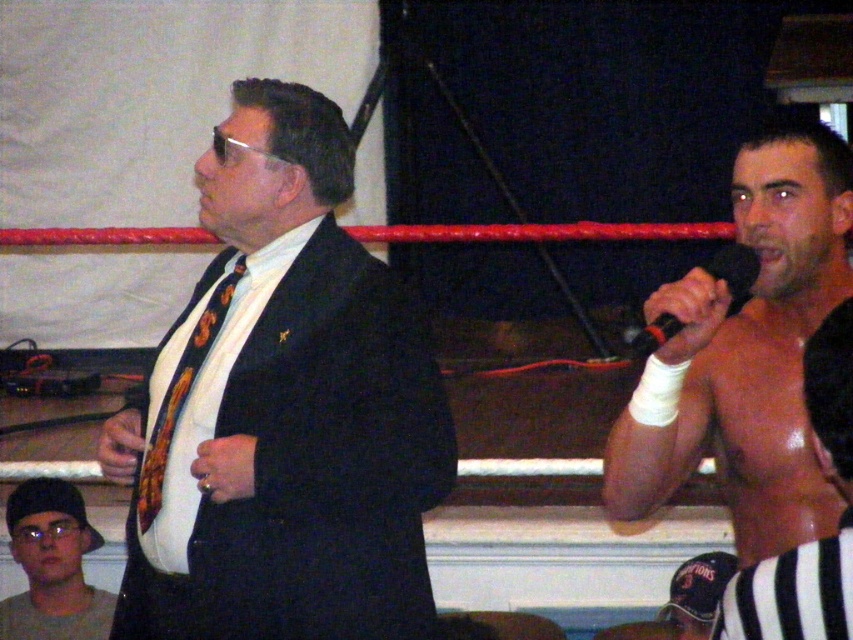
Is point (756, 316) more distant than point (749, 573)?

Yes.

Can you confirm if shiny black microphone at right is bigger than shiny metallic torso at right?

Yes.

Does point (786, 122) come closer to viewer compared to point (850, 339)?

No, it is behind (850, 339).

Identify the location of shiny black microphone at right. (746, 353).

Identify the location of shiny metallic torso at right. 815,540.

Can you confirm if shiny metallic torso at right is bigger than matte black cap at lower left?

No.

I want to click on shiny metallic torso at right, so click(x=815, y=540).

Where is `shiny metallic torso at right`? This screenshot has width=853, height=640. shiny metallic torso at right is located at coordinates (815, 540).

Is black leather cap at lower right further to camera compared to matte black ring at center?

Yes, it is.

Locate an element on the screen. Image resolution: width=853 pixels, height=640 pixels. black leather cap at lower right is located at coordinates (697, 593).